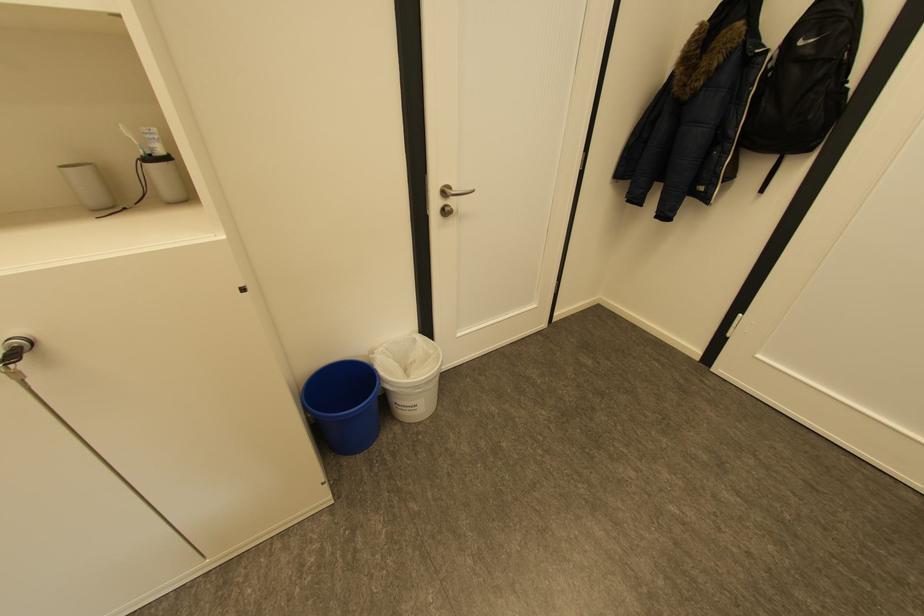
The width and height of the screenshot is (924, 616). I want to click on toothbrush holder, so click(157, 166).